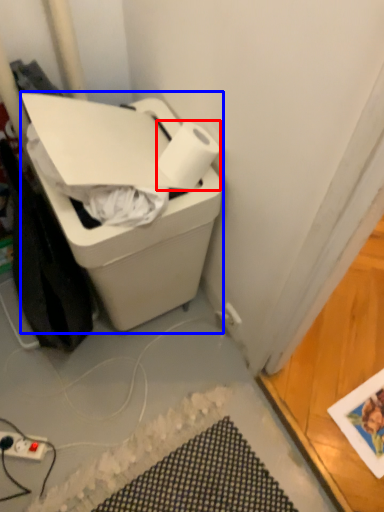
Question: Which point is further to the camera, paper towel (highlighted by a red box) or cardboard box (highlighted by a blue box)?

Choices:
 (A) paper towel
 (B) cardboard box

Answer: (A)